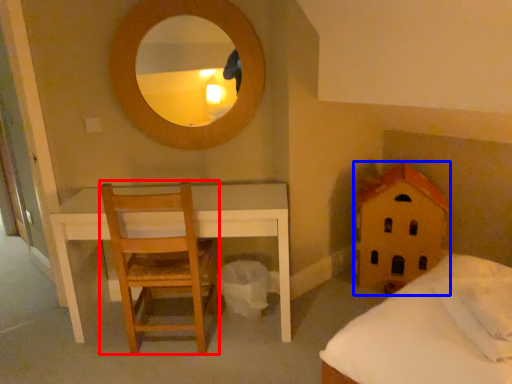
Question: Which of the following is the closest to the observer, chair (highlighted by a red box) or toy (highlighted by a blue box)?

Choices:
 (A) chair
 (B) toy

Answer: (A)